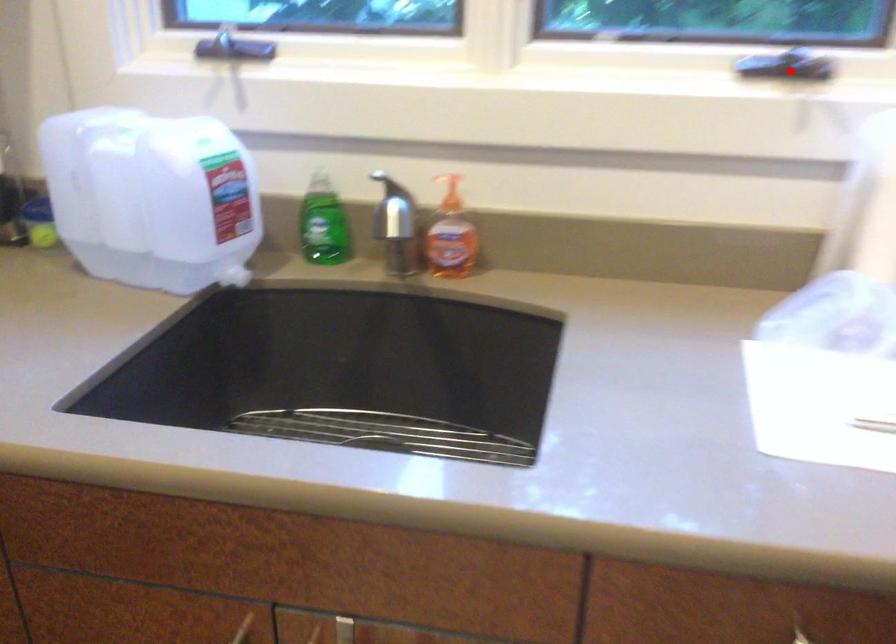
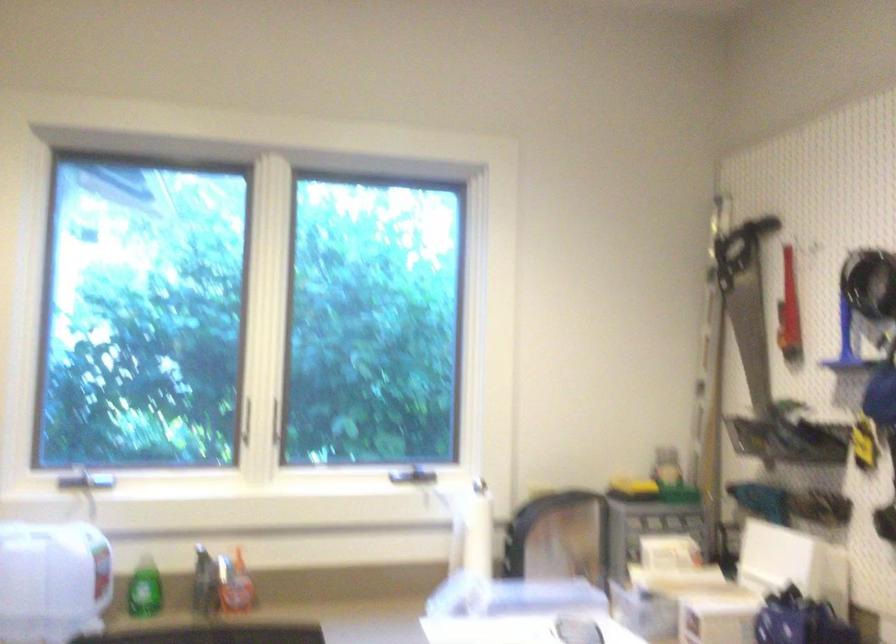
The point at the highlighted location is marked in the first image. Where is the corresponding point in the second image?

(419, 475)